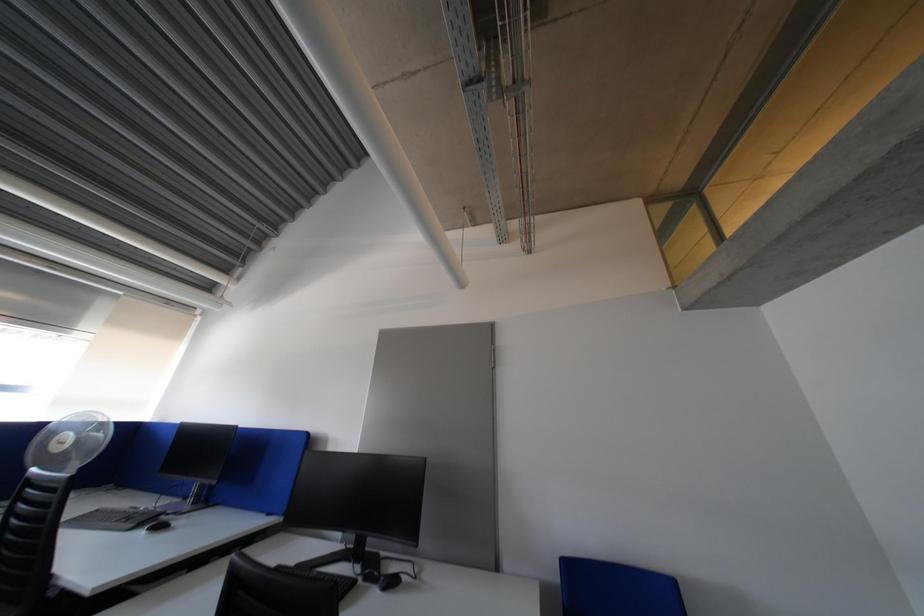
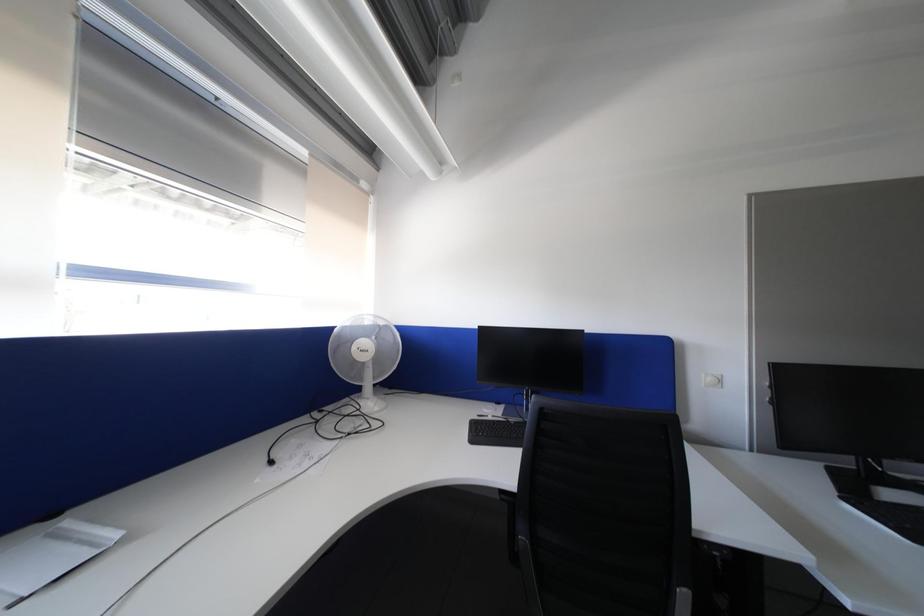
Question: Which direction would the cameraman need to move to produce the second image? Reply with the corresponding letter.

Choices:
 (A) Left
 (B) Right
 (C) Forward
 (D) Backward

Answer: (A)